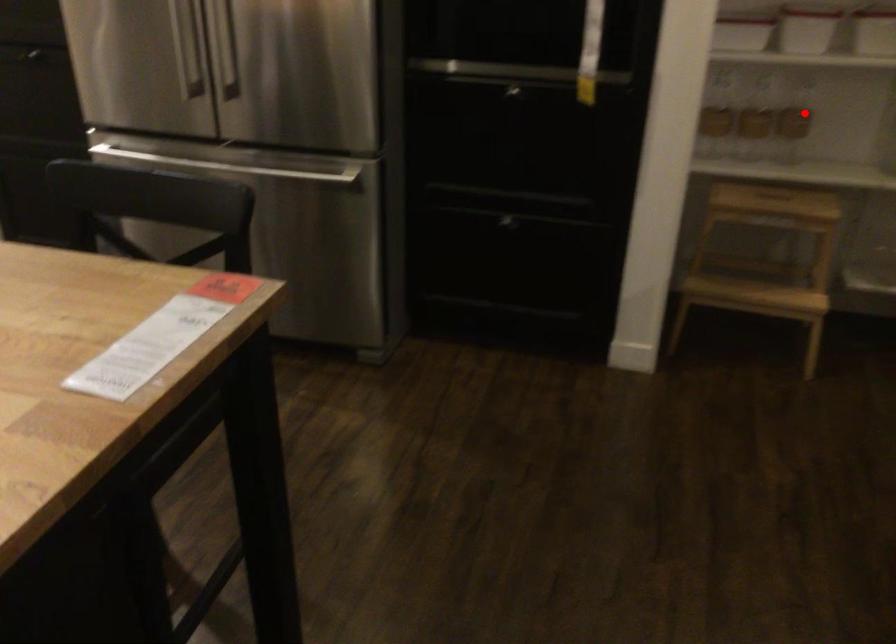
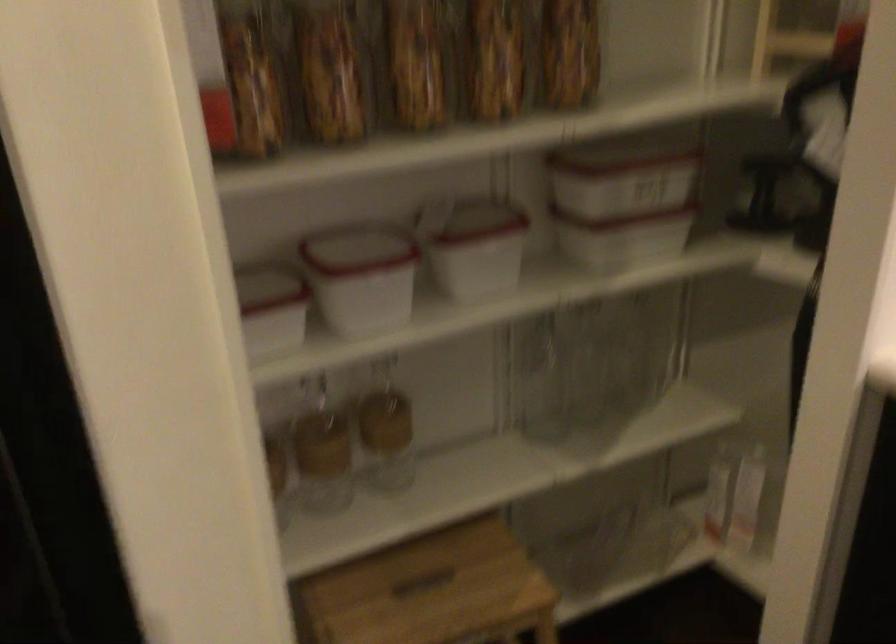
Question: I am providing you with two images of the same scene from different viewpoints. A red point is shown in image1. For the corresponding object point in image2, is it positioned nearer or farther from the camera?

Choices:
 (A) Nearer
 (B) Farther

Answer: (A)